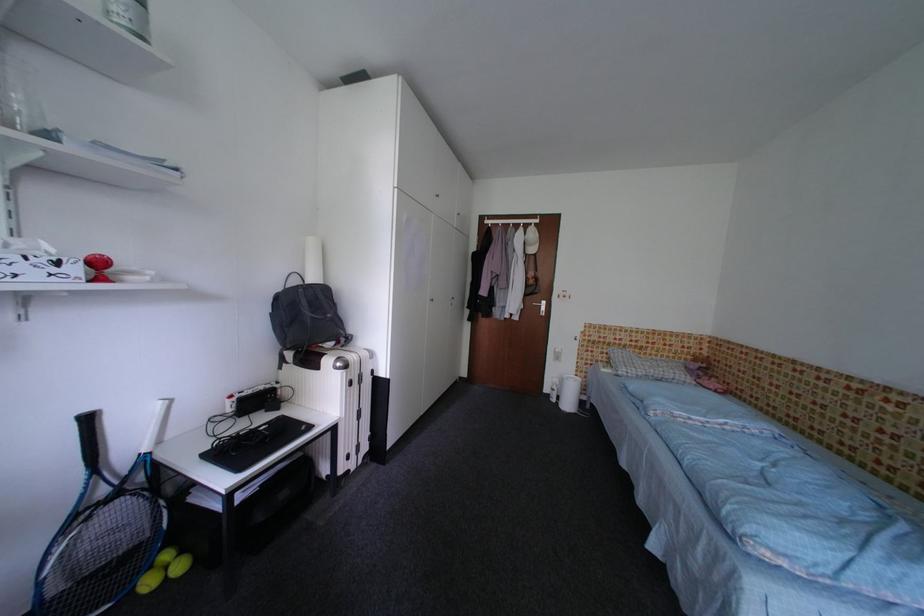
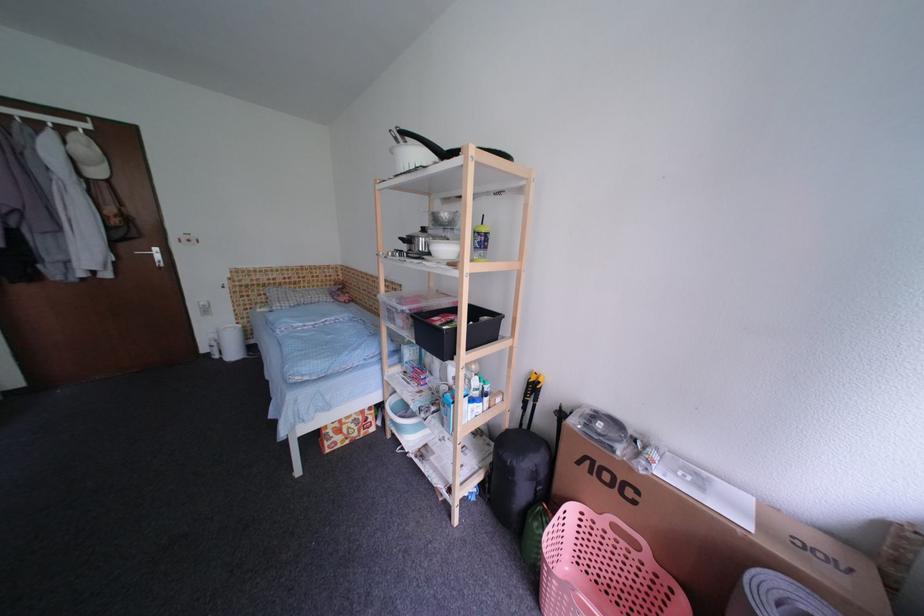
The point at (x=564, y=383) is marked in the first image. Where is the corresponding point in the second image?

(222, 338)